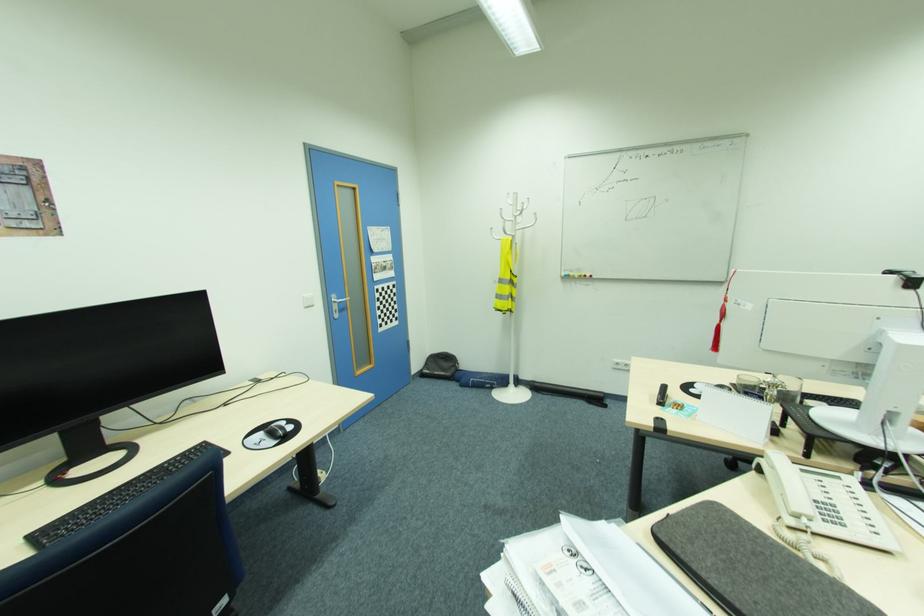
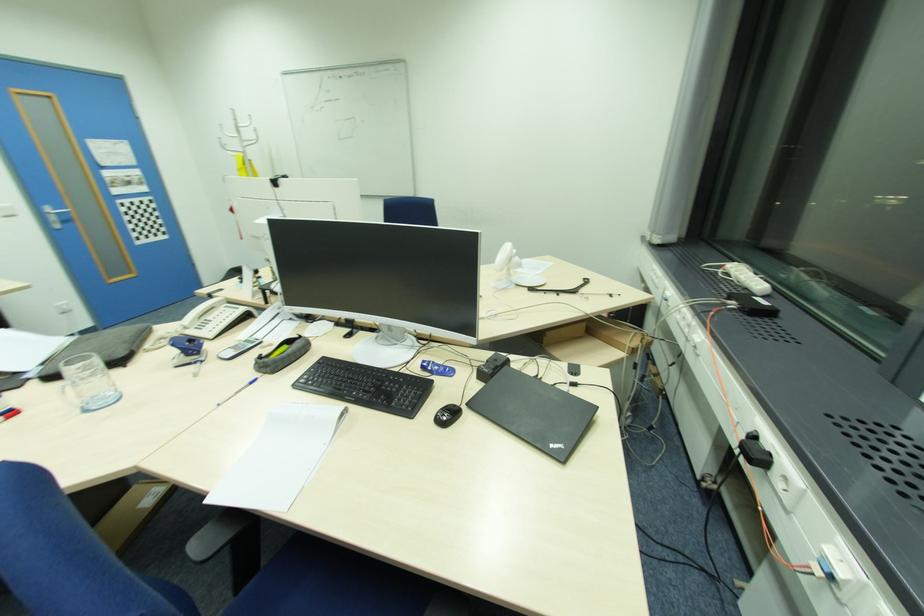
Where in the second image is the point corresponding to the point at 337,302 from the first image?

(54, 213)